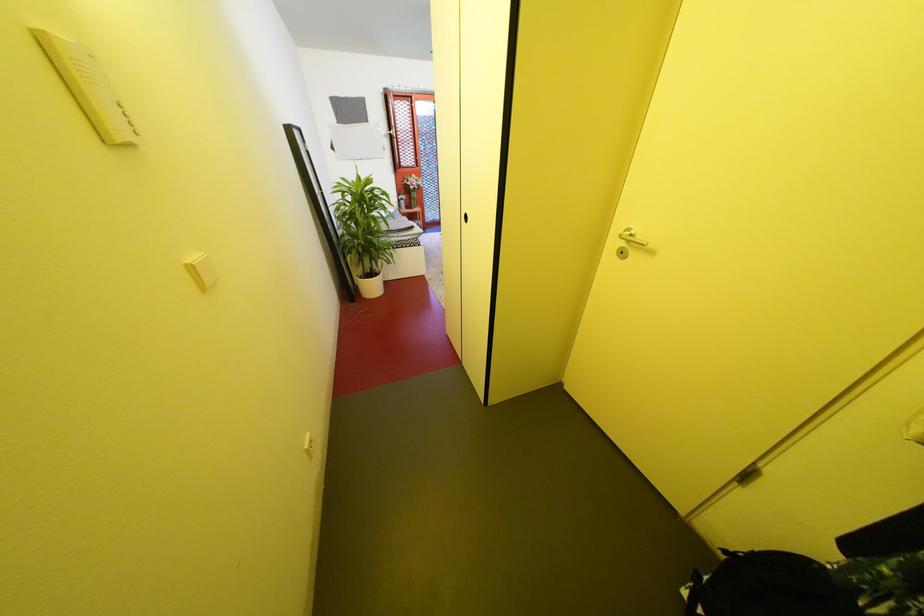
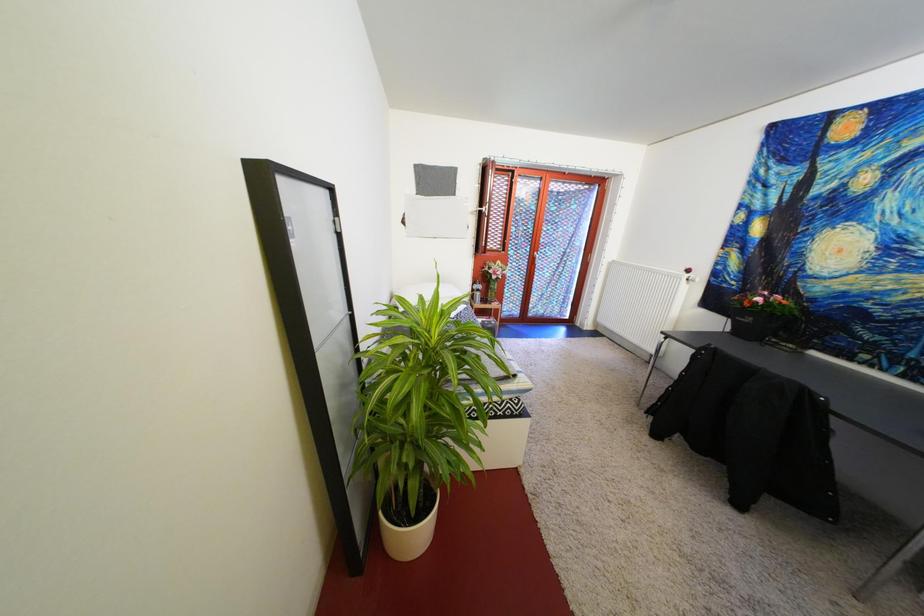
The images are taken continuously from a first-person perspective. In which direction are you moving?

The cameraman walked toward left, forward.